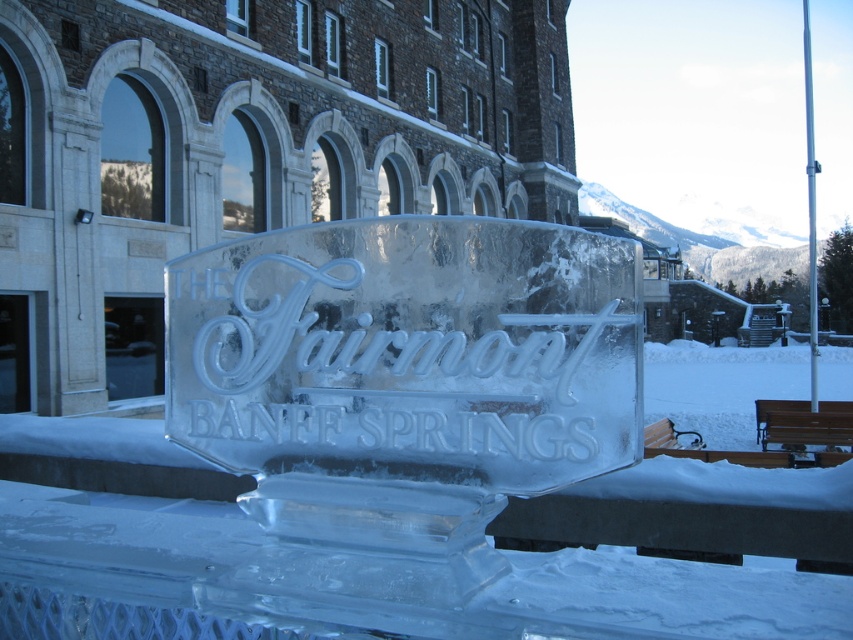
Which is more to the left, transparent ice at center or brown wooden bench at lower right?

From the viewer's perspective, brown wooden bench at lower right appears more on the left side.

Is transparent ice at center below brown wooden bench at lower right?

Correct, transparent ice at center is located below brown wooden bench at lower right.

The height and width of the screenshot is (640, 853). Identify the location of transparent ice at center. (117, 536).